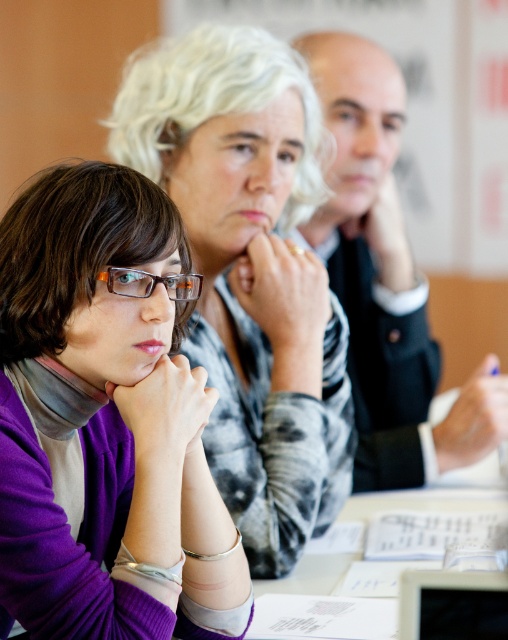
Question: Which point appears closest to the camera in this image?

Choices:
 (A) (407, 586)
 (B) (133, 296)
 (C) (294, 470)

Answer: (A)

Question: Does purple matte sweater at center appear over black glossy tablet at lower right?

Choices:
 (A) no
 (B) yes

Answer: (B)

Question: Is purple matte sweater at center to the right of black glossy tablet at lower right from the viewer's perspective?

Choices:
 (A) yes
 (B) no

Answer: (B)

Question: Based on their relative distances, which object is nearer to the matte gray sweater at center?

Choices:
 (A) smooth black suit at center
 (B) black glossy tablet at lower right

Answer: (A)

Question: Which object appears farthest from the camera in this image?

Choices:
 (A) purple matte sweater at center
 (B) black glossy tablet at lower right
 (C) smooth black suit at center
 (D) matte gray sweater at center

Answer: (C)

Question: Is purple matte sweater at center positioned behind matte gray sweater at center?

Choices:
 (A) no
 (B) yes

Answer: (A)